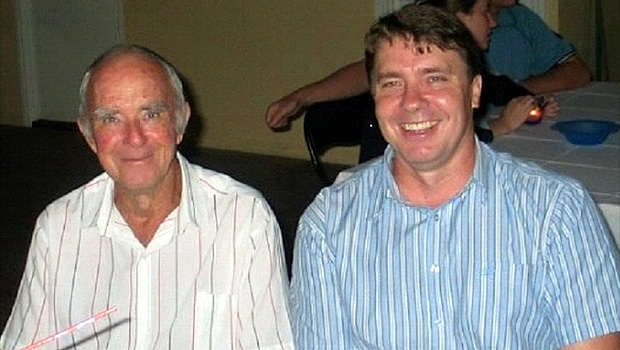
This screenshot has height=350, width=620. I want to click on bowl, so click(x=586, y=132).